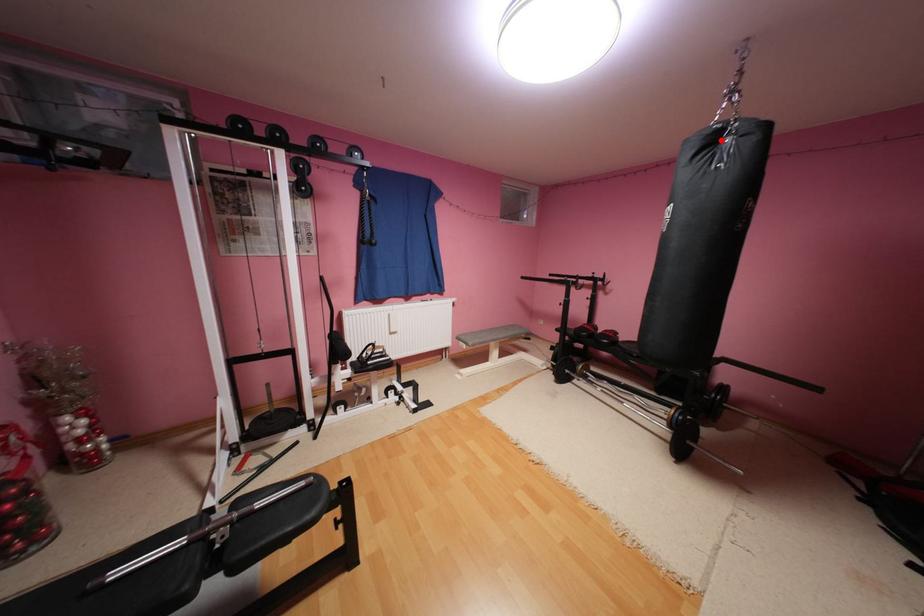
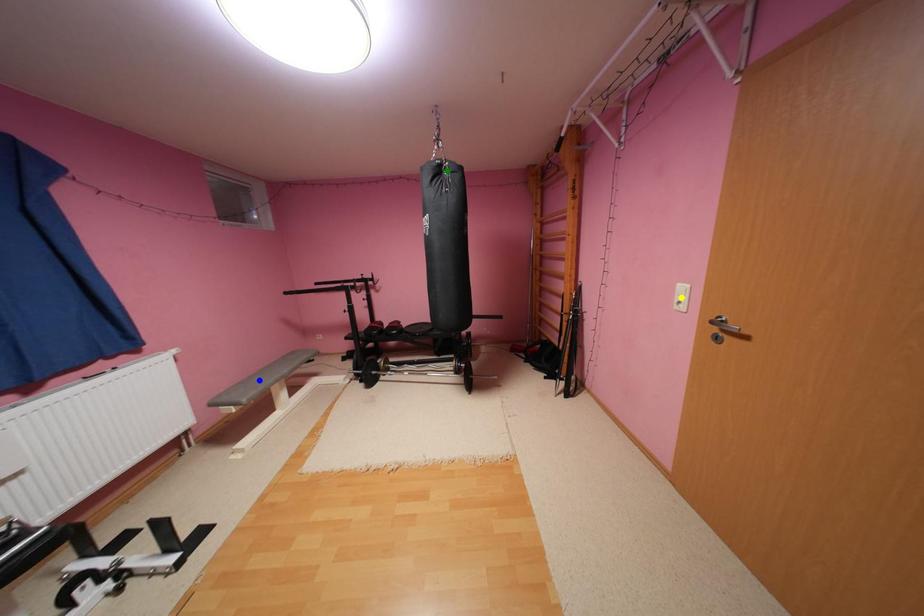
Question: I am providing you with two images of the same scene from different viewpoints. A red point is marked on the first image. You are given multiple points on the second image. Can you choose the point in image 2 that corresponds to the point in image 1?

Choices:
 (A) green point
 (B) yellow point
 (C) blue point

Answer: (A)